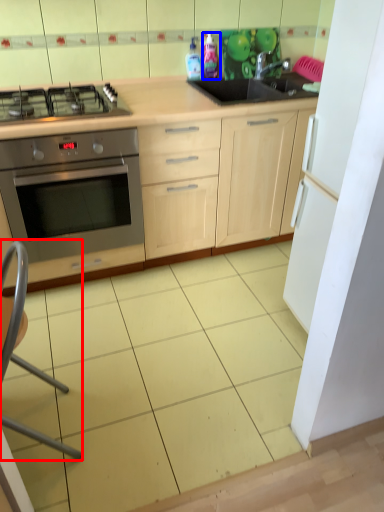
Question: Which point is closer to the camera, folding chair (highlighted by a red box) or bottle (highlighted by a blue box)?

Choices:
 (A) folding chair
 (B) bottle

Answer: (A)